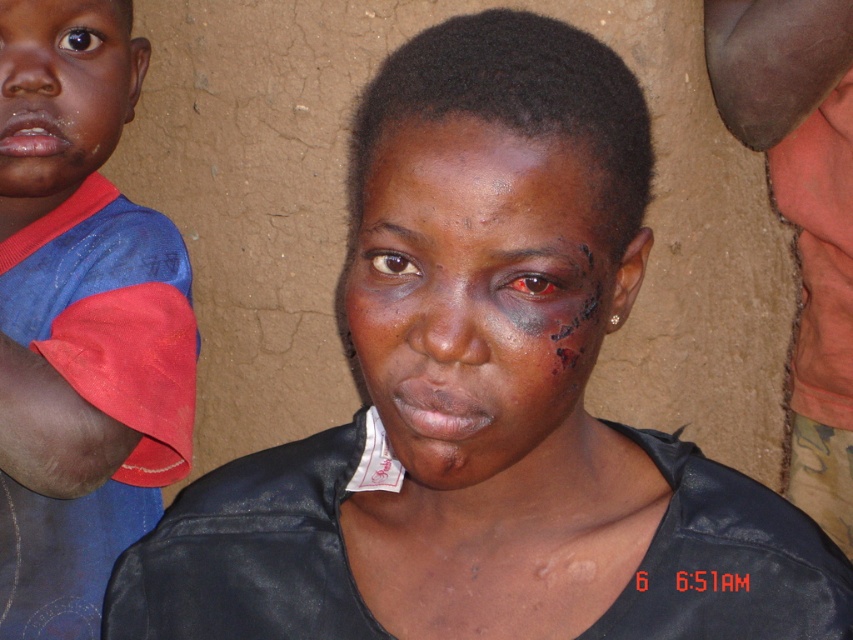
Question: Does dry skin at center have a lesser width compared to matte skin face at upper left?

Choices:
 (A) no
 (B) yes

Answer: (B)

Question: From the image, what is the correct spatial relationship of matte skin face at center in relation to dry skin at center?

Choices:
 (A) right
 (B) left

Answer: (A)

Question: Which of the following is the farthest from the observer?

Choices:
 (A) blue cotton shirt at left
 (B) matte skin face at upper left
 (C) dry skin at center
 (D) matte skin face at center

Answer: (B)

Question: Is dry skin at center above matte skin face at upper left?

Choices:
 (A) yes
 (B) no

Answer: (B)

Question: Which point is closer to the camera?

Choices:
 (A) (102, 115)
 (B) (587, 342)

Answer: (B)

Question: Which of the following is the closest to the observer?

Choices:
 (A) (410, 179)
 (B) (4, 294)

Answer: (A)